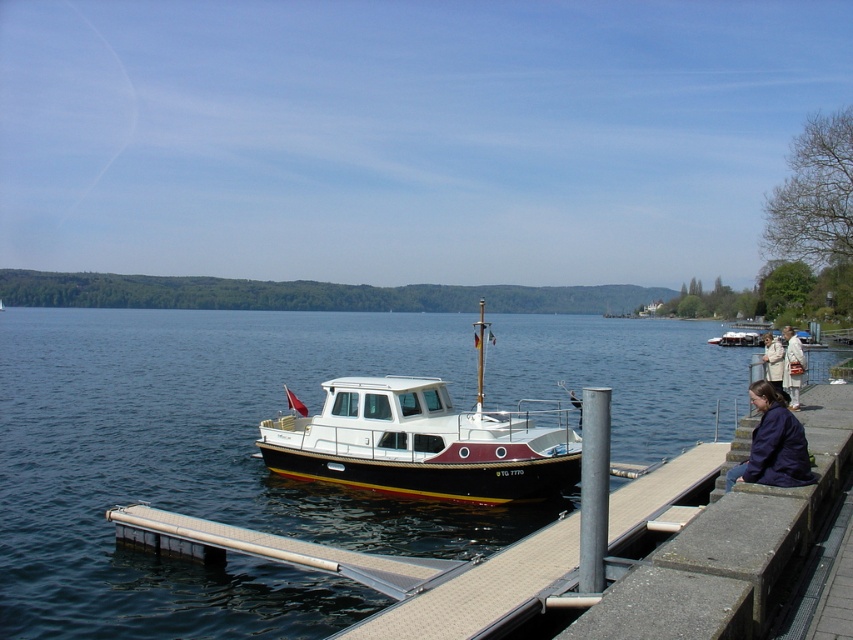
You are standing on the dock and see the point marked at coordinates (421, 442). What object is located at that point?

The point at coordinates (421, 442) corresponds to the white glossy cabin cruiser at center.

In the scene shown: You are a photographer planning to take a picture of the white glossy cabin cruiser at center and the dark blue jacket at lower right. Based on their heights, which object should you focus on first if you want to ensure both are in focus without adjusting the camera settings?

The white glossy cabin cruiser at center has a lesser height compared to the dark blue jacket at lower right, so you should focus on the dark blue jacket at lower right first since it is taller and will require a closer focus point to ensure both are in focus.

You are standing on the dock and want to know where the blue water at center is positioned relative to your viewpoint. Can you determine its coordinates?

The blue water at center is located at coordinates point (x=202, y=467).